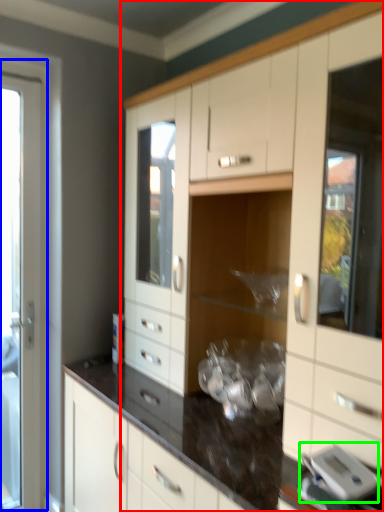
Question: Which object is the closest to the cabinetry (highlighted by a red box)? Choose among these: screen door (highlighted by a blue box) or appliance (highlighted by a green box).

Choices:
 (A) screen door
 (B) appliance

Answer: (B)